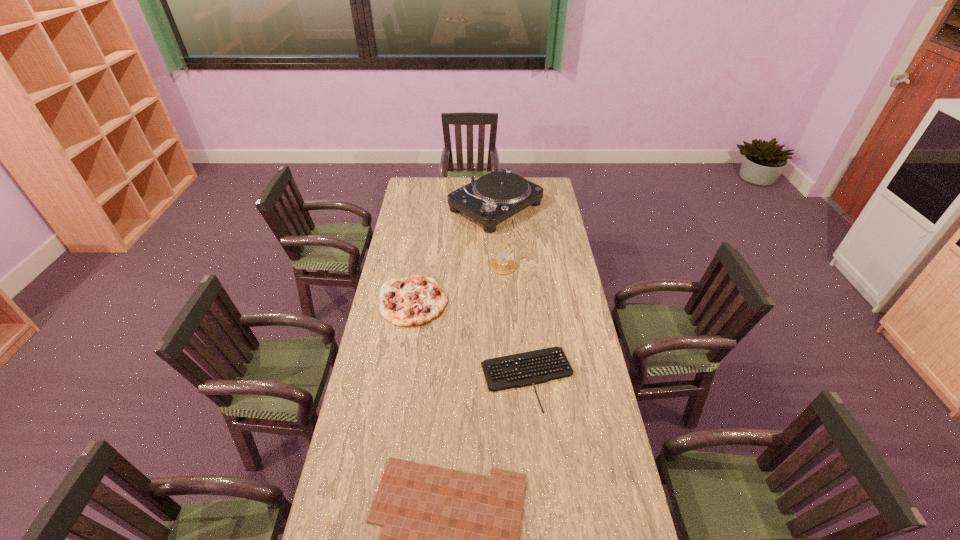
This screenshot has height=540, width=960. I want to click on record player, so click(x=494, y=197).

Locate an element on the screen. Image resolution: width=960 pixels, height=540 pixels. the farthest object is located at coordinates (494, 197).

Find the location of a particular element. cup is located at coordinates (502, 264).

Locate an element on the screen. The width and height of the screenshot is (960, 540). the fourth shortest object is located at coordinates (502, 264).

Identify the location of the third farthest object. (412, 301).

Identify the location of the third tallest object. (412, 301).

The image size is (960, 540). Identify the location of the second shortest object. (535, 367).

Identify the location of computer keyboard. (535, 367).

Find the location of `blank space located 0.300m on the front of the record player`. blank space located 0.300m on the front of the record player is located at coordinates (498, 271).

You are a GUI agent. You are given a task and a screenshot of the screen. Output one action in this format:
    pyautogui.click(x=<x>, y=<y>)
    Task: Click on the free space located 0.180m with the handle on the side of the fourth nearest object
    This screenshot has width=960, height=540.
    Given the screenshot: What is the action you would take?
    pos(505,301)